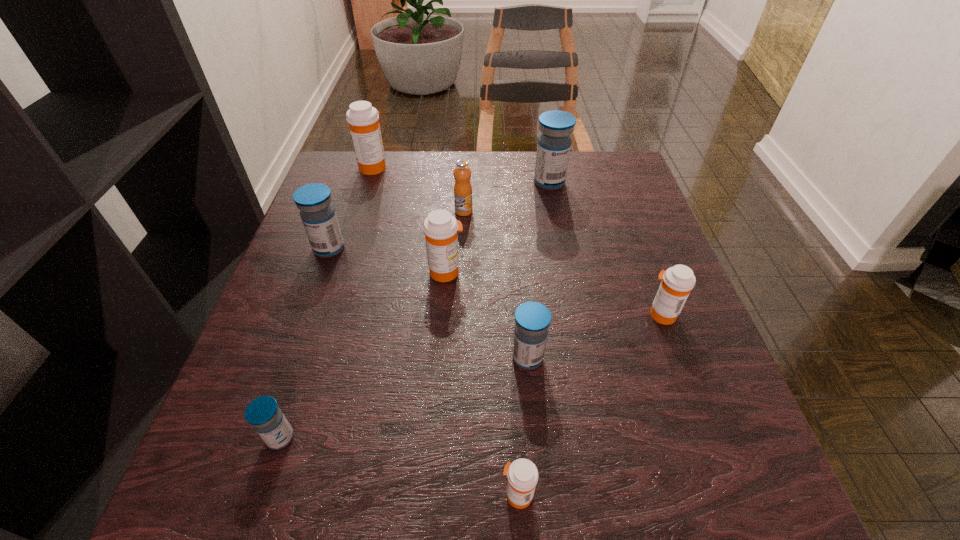
Where is `free spot between the seventh nearest object and the second object from right to left`? Image resolution: width=960 pixels, height=540 pixels. free spot between the seventh nearest object and the second object from right to left is located at coordinates (507, 197).

Identify the location of vacant area between the biggest orange medicine and the third farthest medicine. The width and height of the screenshot is (960, 540). (351, 207).

Identify the location of vacant area that lies between the second blue medicine from right to left and the smallest orange medicine. The height and width of the screenshot is (540, 960). (522, 426).

This screenshot has height=540, width=960. I want to click on object that stands as the closest to the biggest orange medicine, so click(463, 203).

I want to click on the fourth closest object to the smallest blue medicine, so click(x=317, y=213).

Choose which medicine is the third nearest neighbor to the rightmost object. Please provide its 2D coordinates. Your answer should be formatted as a tuple, i.e. [(x, y)], where the tuple contains the x and y coordinates of a point satisfying the conditions above.

[(522, 474)]

Point out which medicine is positioned as the fourth nearest to the second farthest orange medicine. Please provide its 2D coordinates. Your answer should be formatted as a tuple, i.e. [(x, y)], where the tuple contains the x and y coordinates of a point satisfying the conditions above.

[(267, 419)]

I want to click on the third closest blue medicine relative to the biggest orange medicine, so click(532, 319).

Locate an element on the screen. The image size is (960, 540). the second closest blue medicine relative to the farthest blue medicine is located at coordinates (532, 319).

Select which orange medicine appears as the second closest to the third nearest medicine. Please provide its 2D coordinates. Your answer should be formatted as a tuple, i.e. [(x, y)], where the tuple contains the x and y coordinates of a point satisfying the conditions above.

[(522, 474)]